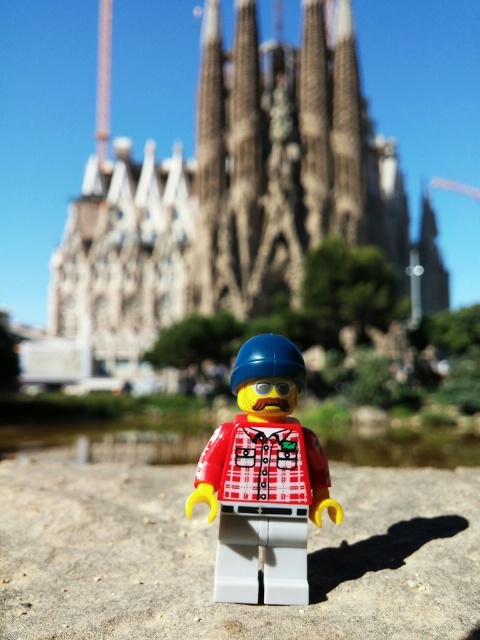
You are a Lego figure standing on the gray stone sand at center. You want to reach the Sagrada Familia cathedral in the background. The cathedral is 37.80 meters away from you. If you can walk 1.5 meters per second, how long will it take you to reach the Sagrada Familia cathedral?

The distance between you and the Sagrada Familia cathedral is 37.80 meters. At a walking speed of 1.5 meters per second, it will take 25.2 seconds to reach the cathedral.

You are a photographer trying to capture the Sagrada Familia in the background while focusing on the plaid fabric minifigure at center. Since the gray stone sand at center is in the way, can you move the minifigure to a position where it is not blocked by the sand?

The gray stone sand at center is closer to the viewer than the plaid fabric minifigure at center. To avoid blocking the minifigure, move it behind the sand so that it remains visible but not obscured by the sand being in front.